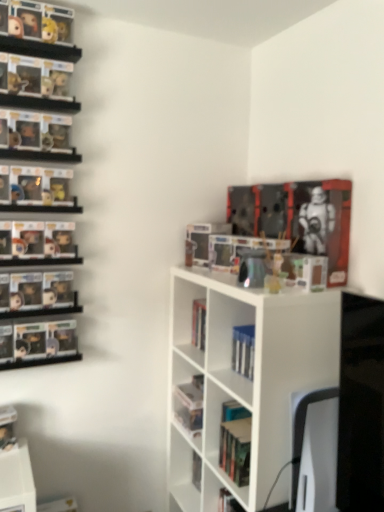
Question: From a real-world perspective, is blue hardcover book at center, which is counted as the 2th book, starting from the right, positioned over white matte bookshelf at center based on gravity?

Choices:
 (A) yes
 (B) no

Answer: (A)

Question: Is blue hardcover book at center, which is counted as the 2th book, starting from the right, touching white matte bookshelf at center?

Choices:
 (A) no
 (B) yes

Answer: (A)

Question: Is white matte bookshelf at center at the back of blue hardcover book at center, acting as the 1th book starting from the left?

Choices:
 (A) no
 (B) yes

Answer: (B)

Question: From the image's perspective, is blue hardcover book at center, which is counted as the 2th book, starting from the right, under white matte bookshelf at center?

Choices:
 (A) yes
 (B) no

Answer: (B)

Question: Could you tell me if blue hardcover book at center, the 1th book ordered from the bottom, is facing white matte bookshelf at center?

Choices:
 (A) yes
 (B) no

Answer: (A)

Question: Is blue hardcover book at center, which is counted as the 2th book, starting from the right, taller or shorter than white matte bookshelf at center?

Choices:
 (A) short
 (B) tall

Answer: (A)

Question: Considering the positions of point (241, 348) and point (283, 290), is point (241, 348) closer or farther from the camera than point (283, 290)?

Choices:
 (A) closer
 (B) farther

Answer: (B)

Question: In the image, is blue hardcover book at center, which is counted as the 2th book, starting from the right, on the left side or the right side of white matte bookshelf at center?

Choices:
 (A) left
 (B) right

Answer: (A)

Question: Considering their positions, is blue hardcover book at center, acting as the 1th book starting from the left, located in front of or behind white matte bookshelf at center?

Choices:
 (A) behind
 (B) front

Answer: (A)

Question: Would you say metallic silver robot at upper right, which is the 2th book in left-to-right order, is to the left or to the right of blue hardcover book at center, the 1th book ordered from the bottom, in the picture?

Choices:
 (A) right
 (B) left

Answer: (A)

Question: From the image's perspective, is metallic silver robot at upper right, placed as the second book when sorted from bottom to top, positioned above or below blue hardcover book at center, which is counted as the 2th book, starting from the right?

Choices:
 (A) below
 (B) above

Answer: (B)

Question: Relative to blue hardcover book at center, the 1th book ordered from the bottom, is metallic silver robot at upper right, the first book in the top-to-bottom sequence, in front or behind?

Choices:
 (A) front
 (B) behind

Answer: (A)

Question: From a real-world perspective, is metallic silver robot at upper right, which ranks as the first book in right-to-left order, physically located above or below blue hardcover book at center, which is counted as the 2th book, starting from the right?

Choices:
 (A) below
 (B) above

Answer: (B)

Question: Considering the relative positions of metallic silver robot at upper right, which is the 2th book in left-to-right order, and white matte bookshelf at center in the image provided, is metallic silver robot at upper right, which is the 2th book in left-to-right order, to the left or to the right of white matte bookshelf at center?

Choices:
 (A) right
 (B) left

Answer: (A)

Question: From a real-world perspective, is metallic silver robot at upper right, which ranks as the first book in right-to-left order, above or below white matte bookshelf at center?

Choices:
 (A) above
 (B) below

Answer: (A)